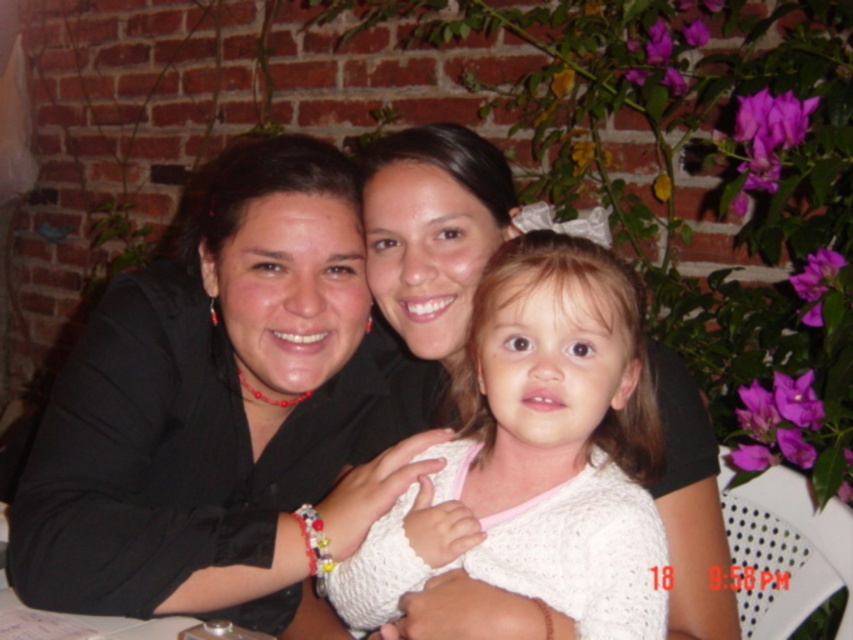
Question: Among these points, which one is nearest to the camera?

Choices:
 (A) (12, 580)
 (B) (390, 548)

Answer: (B)

Question: Is black matte jacket at center to the left of white knitted sweater at center from the viewer's perspective?

Choices:
 (A) yes
 (B) no

Answer: (A)

Question: Among these points, which one is nearest to the camera?

Choices:
 (A) (541, 492)
 (B) (28, 474)

Answer: (A)

Question: Which object is farther from the camera taking this photo?

Choices:
 (A) black matte jacket at center
 (B) white knitted sweater at center

Answer: (A)

Question: Where is black matte jacket at center located in relation to white knitted sweater at center in the image?

Choices:
 (A) below
 (B) above

Answer: (B)

Question: Is black matte jacket at center smaller than white knitted sweater at center?

Choices:
 (A) yes
 (B) no

Answer: (B)